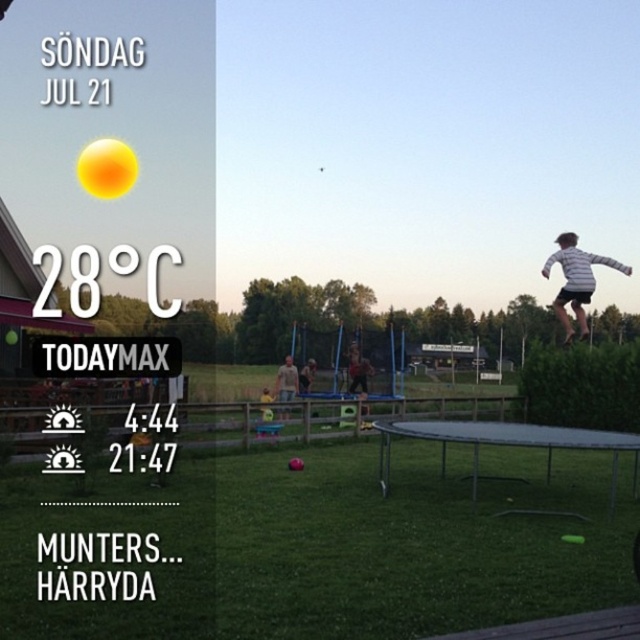
Question: Which object appears farthest from the camera in this image?

Choices:
 (A) metallic trampoline at center
 (B) striped cotton shirt at upper right

Answer: (B)

Question: Among these points, which one is nearest to the camera?

Choices:
 (A) (636, 476)
 (B) (584, 316)

Answer: (B)

Question: Is the position of metallic trampoline at center less distant than that of striped cotton shirt at upper right?

Choices:
 (A) yes
 (B) no

Answer: (A)

Question: Is metallic trampoline at center positioned in front of striped cotton shirt at upper right?

Choices:
 (A) yes
 (B) no

Answer: (A)

Question: Can you confirm if metallic trampoline at center is bigger than striped cotton shirt at upper right?

Choices:
 (A) no
 (B) yes

Answer: (A)

Question: Which point appears farthest from the camera in this image?

Choices:
 (A) (570, 260)
 (B) (561, 442)

Answer: (A)